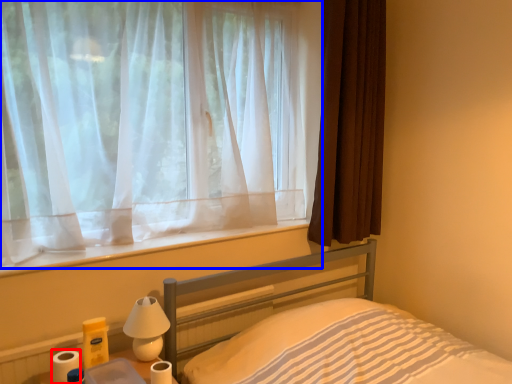
Question: Which point is further to the camera, toilet paper (highlighted by a red box) or curtain (highlighted by a blue box)?

Choices:
 (A) toilet paper
 (B) curtain

Answer: (A)